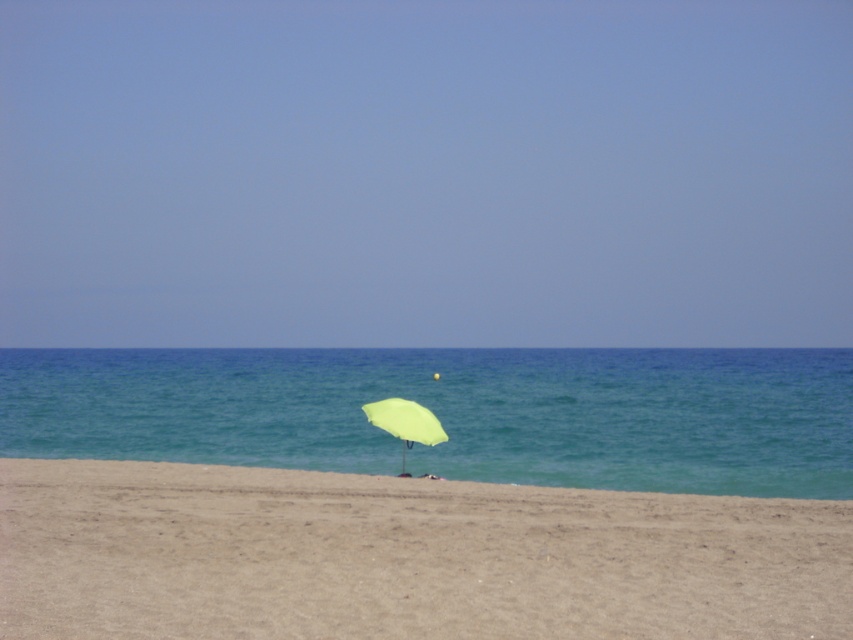
You are standing on the beach looking at the scene. Which object is higher up in the image, the transparent blue water at center or the light green fabric umbrella at center?

The transparent blue water at center is higher up in the image than the light green fabric umbrella at center because the description states that it is above the umbrella.

You are standing on the beach and want to place a small sandcastle exactly halfway between the transparent blue water at center and the light green fabric umbrella at center. Which object will the sandcastle be closer to?

The sandcastle will be closer to the transparent blue water at center because its width is greater than the light green fabric umbrella at center, making the distance from the umbrella shorter.